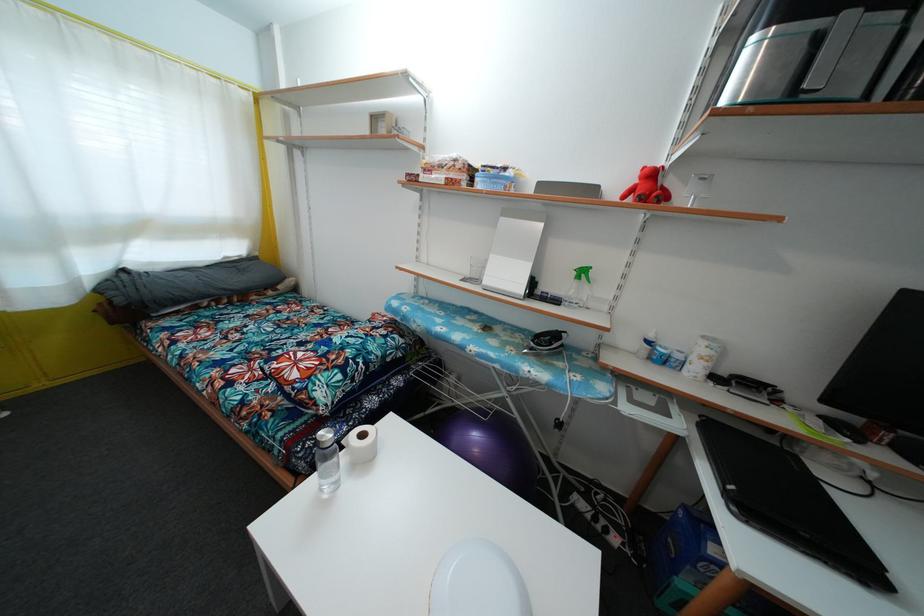
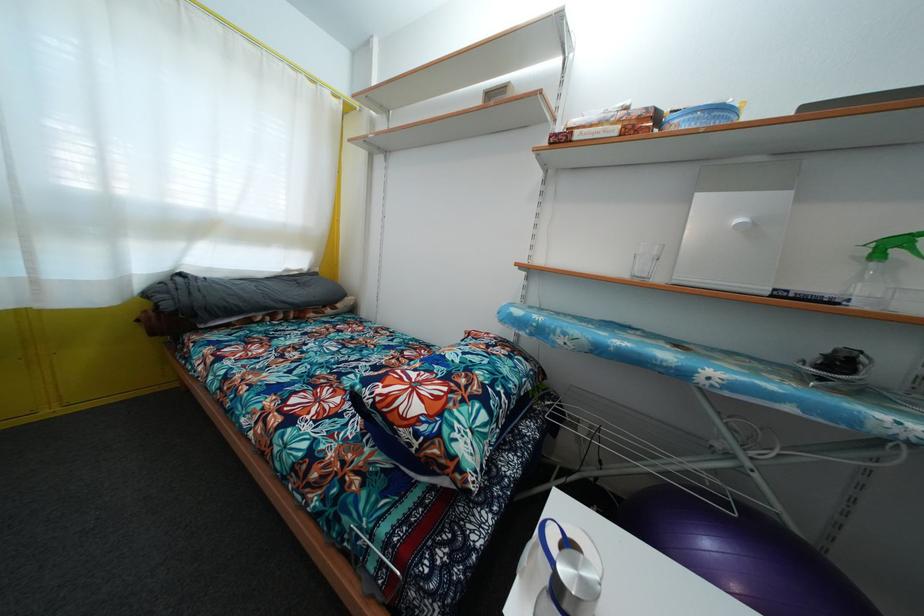
From the picture: The images are taken continuously from a first-person perspective. In which direction are you moving?

The cameraman moved toward left, forward.